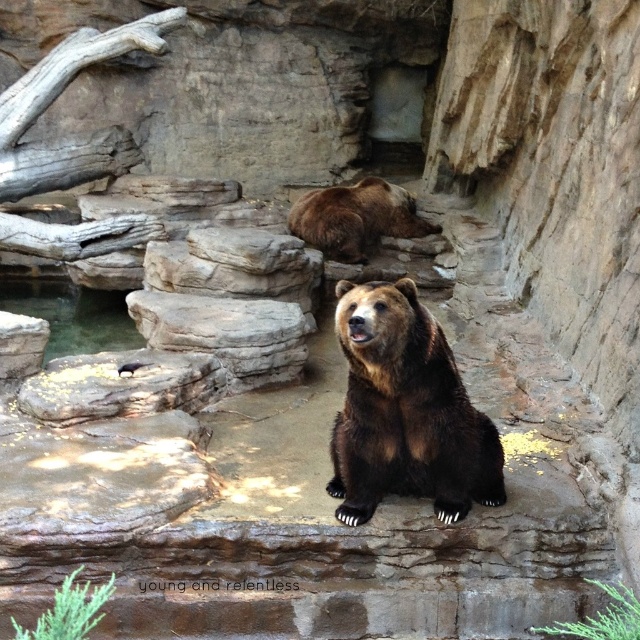
Is brown furry bear at center positioned before brown furry bear at upper center?

Yes.

Is point (381, 353) less distant than point (406, 214)?

That is True.

Between point (476, 492) and point (392, 193), which one is positioned in front?

Point (476, 492) is more forward.

Where is `brown furry bear at center`? The height and width of the screenshot is (640, 640). brown furry bear at center is located at coordinates (404, 412).